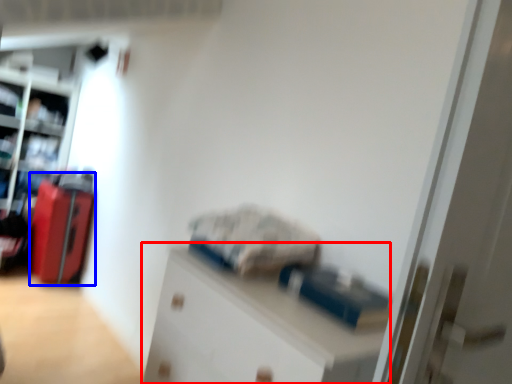
Question: Which object appears farthest to the camera in this image, cabinetry (highlighted by a red box) or luggage (highlighted by a blue box)?

Choices:
 (A) cabinetry
 (B) luggage

Answer: (B)